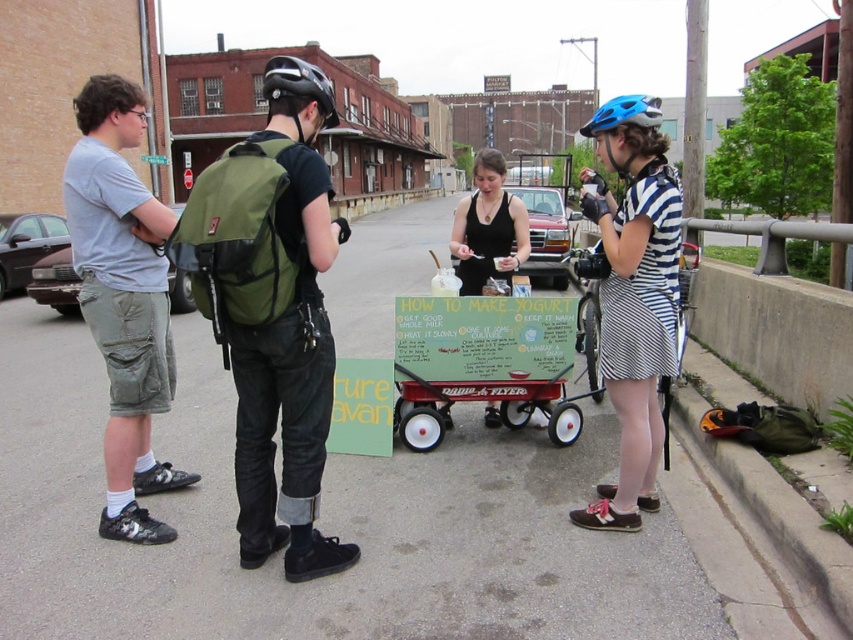
Does green fabric backpack at center have a lesser height compared to striped cotton dress at right?

Yes.

Who is more distant from viewer, (303, 273) or (611, 305)?

Positioned behind is point (611, 305).

Image resolution: width=853 pixels, height=640 pixels. I want to click on green fabric backpack at center, so click(x=273, y=310).

Is the position of light gray cotton t-shirt at left more distant than that of blue matte bicycle helmet at upper right?

No, light gray cotton t-shirt at left is in front of blue matte bicycle helmet at upper right.

Does light gray cotton t-shirt at left appear on the right side of blue matte bicycle helmet at upper right?

Incorrect, light gray cotton t-shirt at left is not on the right side of blue matte bicycle helmet at upper right.

Who is more distant from viewer, (86, 108) or (589, 131)?

Point (589, 131)

The width and height of the screenshot is (853, 640). I want to click on light gray cotton t-shirt at left, so click(123, 298).

In the scene shown: Between striped cotton dress at right and black matte helmet at upper center, which one appears on the right side from the viewer's perspective?

striped cotton dress at right

Measure the distance between point (622,497) and camera.

Point (622,497) and camera are 3.88 meters apart.

Locate an element on the screen. Image resolution: width=853 pixels, height=640 pixels. striped cotton dress at right is located at coordinates (633, 296).